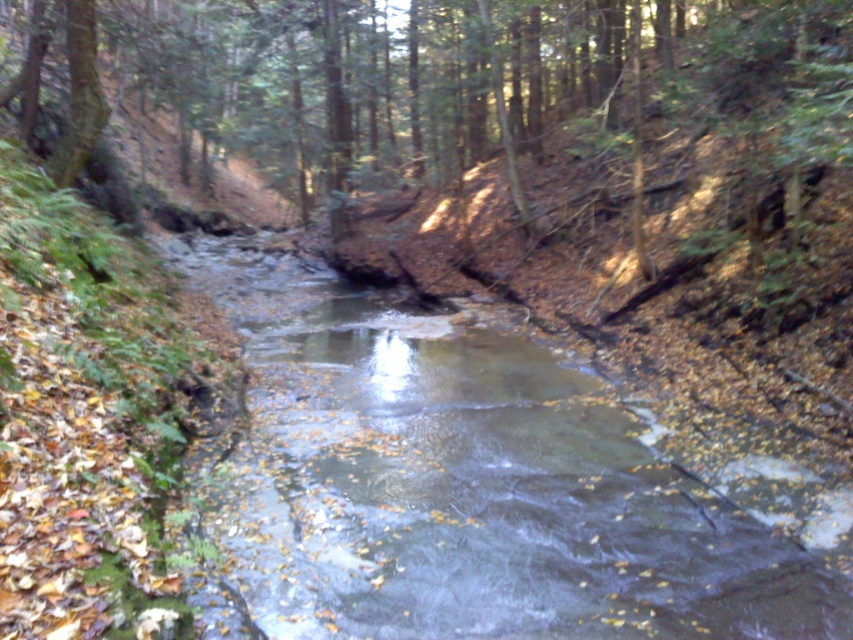
You are a hiker who wants to cross the stream using the brown wood tree at center. Can you see the clear water at center from where you are standing?

Yes, the clear water at center is in front of the brown wood tree at center, so you can see it from your current position.

In the scene shown: You are a hiker carrying a 10 feet long wooden plank. You want to cross the stream using the clear water at center. Can you place the plank from your current position to the other side of the stream?

The distance of clear water at center from camera is 12.33 feet. Since the plank is only 10 feet long, it will not reach the other side of the stream.